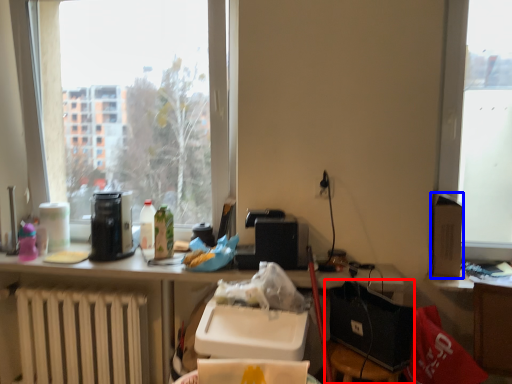
Question: Among these objects, which one is nearest to the camera, chair (highlighted by a red box) or box (highlighted by a blue box)?

Choices:
 (A) chair
 (B) box

Answer: (A)